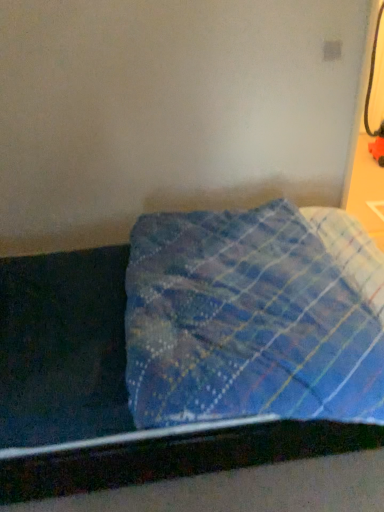
The image size is (384, 512). I want to click on blue plaid fabric at center, so click(x=127, y=392).

Describe the element at coordinates (127, 392) in the screenshot. I see `blue plaid fabric at center` at that location.

Consider the image. Measure the distance between point (283, 323) and camera.

Point (283, 323) is 1.30 meters away from camera.

This screenshot has height=512, width=384. I want to click on blue plaid fabric at center, so click(x=127, y=392).